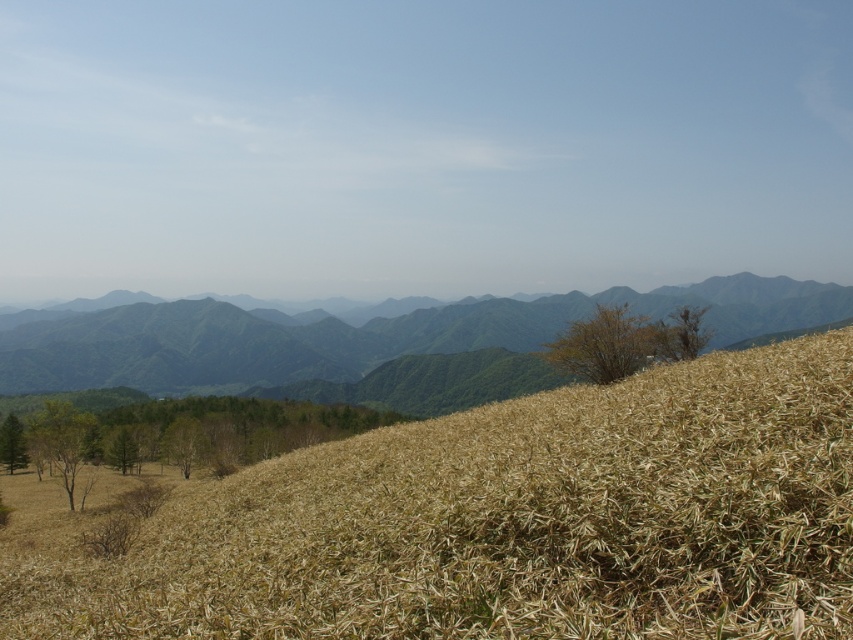
Between brown dry grass at center and brown textured tree at upper right, which one is positioned higher?

brown textured tree at upper right

Which is more to the left, brown dry grass at center or brown textured tree at upper right?

Positioned to the left is brown dry grass at center.

Locate an element on the screen. This screenshot has height=640, width=853. brown dry grass at center is located at coordinates (503, 522).

Where is `brown dry grass at center`? brown dry grass at center is located at coordinates (503, 522).

Which is behind, point (665, 342) or point (4, 448)?

Point (4, 448)

Is brown textured tree at upper right positioned at the back of green matte tree at lower left?

That is False.

Locate an element on the screen. brown textured tree at upper right is located at coordinates (682, 333).

Can you confirm if brown dry grass at center is bigger than green leafy tree at lower left?

Indeed, brown dry grass at center has a larger size compared to green leafy tree at lower left.

Is point (503, 515) positioned behind point (62, 461)?

No, it is in front of (62, 461).

Is point (846, 380) positioned before point (65, 490)?

That is True.

The width and height of the screenshot is (853, 640). Identify the location of brown dry grass at center. (503, 522).